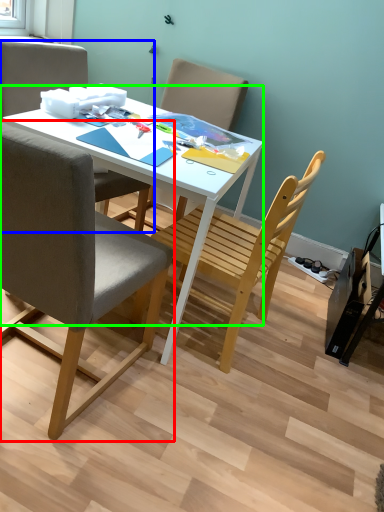
Question: Based on their relative distances, which object is farther from chair (highlighted by a red box)? Choose from chair (highlighted by a blue box) and desk (highlighted by a green box).

Choices:
 (A) chair
 (B) desk

Answer: (A)